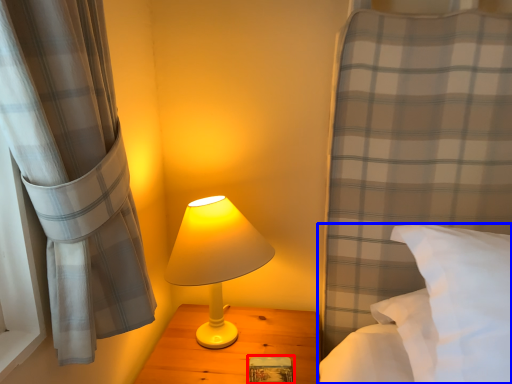
Question: Which object appears farthest to the camera in this image, book (highlighted by a red box) or bed (highlighted by a blue box)?

Choices:
 (A) book
 (B) bed

Answer: (A)